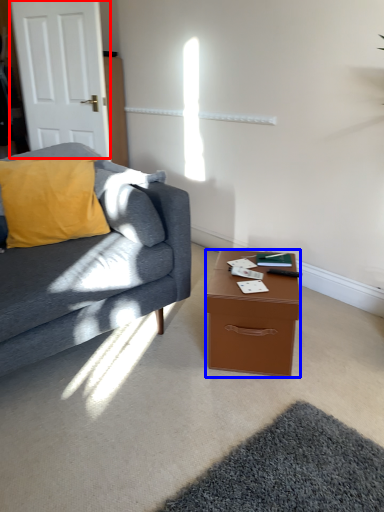
Question: Which of the following is the closest to the observer, door (highlighted by a red box) or desk (highlighted by a blue box)?

Choices:
 (A) door
 (B) desk

Answer: (B)